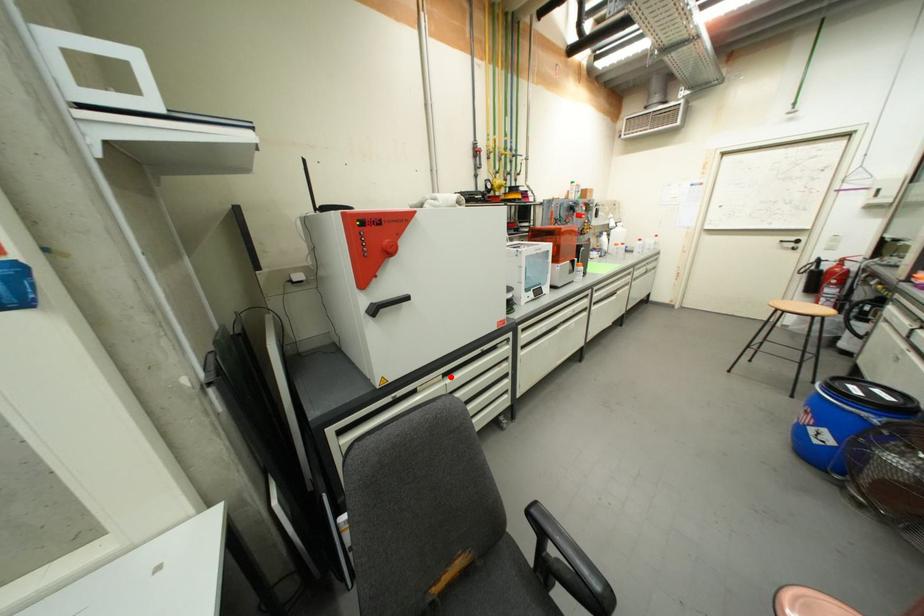
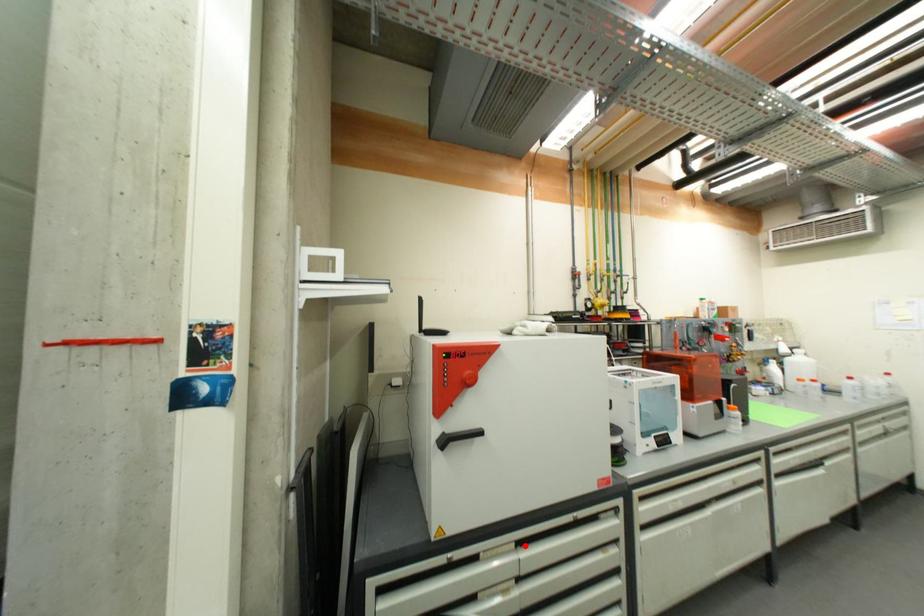
I am providing you with two images of the same scene from different viewpoints. A red point is marked on the first image and another point is marked on the second image. Is the red point in image1 aligned with the point shown in image2?

Yes